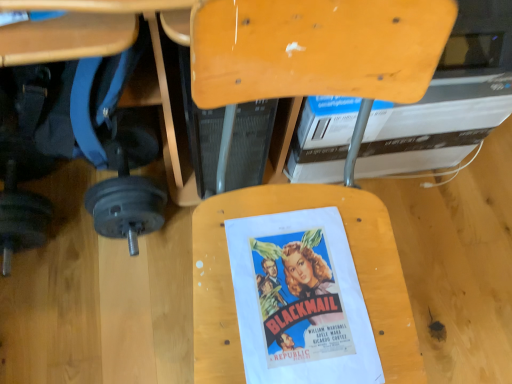
Where is `free space to the left of wooden chair at center`? free space to the left of wooden chair at center is located at coordinates (131, 317).